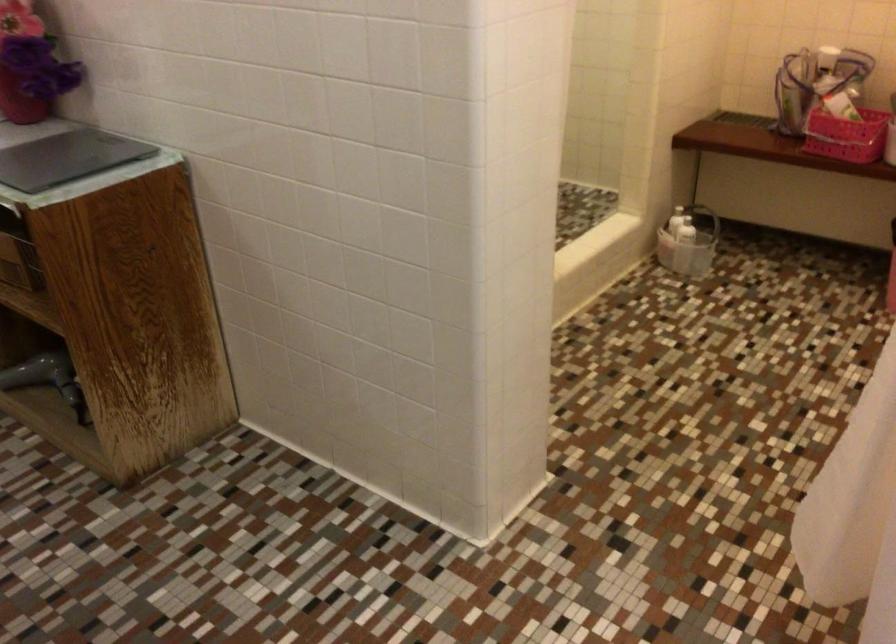
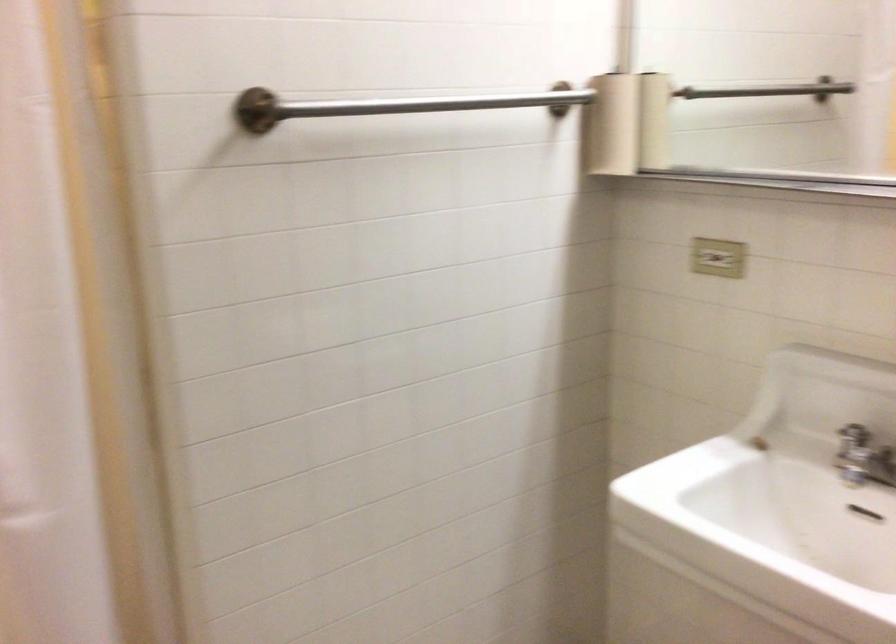
Question: The camera is either moving clockwise (left) or counter-clockwise (right) around the object. The first image is from the beginning of the video and the second image is from the end. Is the camera moving left or right when shooting the video?

Choices:
 (A) Left
 (B) Right

Answer: (A)